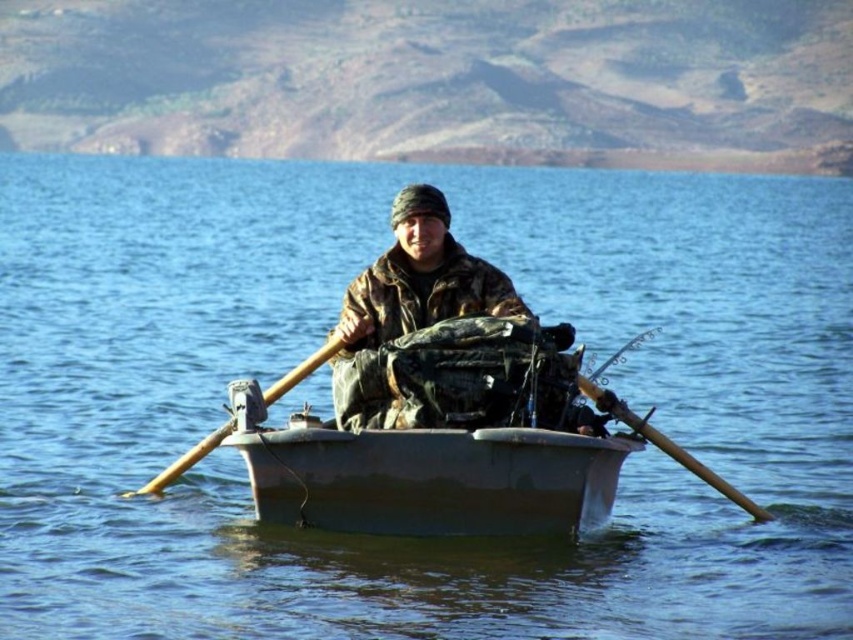
You are a drone operator trying to locate a specific point in the image. The point you need to find is point (431, 477). Which object in the scene is this point located on?

The point (431, 477) is located on the gray matte canoe at center.

Based on the photo, you are a person in a boat and need to choose between the yellow wood paddle at center and the wooden at right to row. Which one is larger in size?

The yellow wood paddle at center is bigger than the wooden at right, so you should choose the yellow wood paddle at center as it is larger in size.